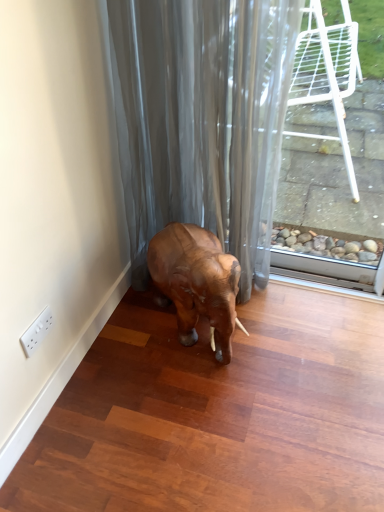
Where is `brown wooden elephant at center`? brown wooden elephant at center is located at coordinates tap(196, 282).

The height and width of the screenshot is (512, 384). What do you see at coordinates (196, 282) in the screenshot? I see `brown wooden elephant at center` at bounding box center [196, 282].

This screenshot has height=512, width=384. What do you see at coordinates (202, 120) in the screenshot?
I see `satin gray curtain at lower center` at bounding box center [202, 120].

What is the approximate width of satin gray curtain at lower center?

14.34 inches.

Identify the location of satin gray curtain at lower center. (202, 120).

I want to click on brown wooden elephant at center, so tap(196, 282).

Would you say brown wooden elephant at center is to the left or to the right of satin gray curtain at lower center in the picture?

In the image, brown wooden elephant at center appears on the right side of satin gray curtain at lower center.

Who is more distant, brown wooden elephant at center or satin gray curtain at lower center?

brown wooden elephant at center is further from the camera.

Does point (181, 241) lie behind point (180, 111)?

Yes, it is behind point (180, 111).

From the image's perspective, is brown wooden elephant at center located above or below satin gray curtain at lower center?

From the image's perspective, brown wooden elephant at center appears below satin gray curtain at lower center.

From a real-world perspective, between brown wooden elephant at center and satin gray curtain at lower center, who is vertically lower?

brown wooden elephant at center.

Considering the sizes of brown wooden elephant at center and satin gray curtain at lower center in the image, is brown wooden elephant at center wider or thinner than satin gray curtain at lower center?

Considering their sizes, brown wooden elephant at center looks broader than satin gray curtain at lower center.

Considering the relative sizes of brown wooden elephant at center and satin gray curtain at lower center in the image provided, is brown wooden elephant at center taller than satin gray curtain at lower center?

In fact, brown wooden elephant at center may be shorter than satin gray curtain at lower center.

Which of these two, brown wooden elephant at center or satin gray curtain at lower center, is smaller?

brown wooden elephant at center is smaller.

Is brown wooden elephant at center not inside satin gray curtain at lower center?

No, brown wooden elephant at center is inside or overlapping with satin gray curtain at lower center.

Are brown wooden elephant at center and satin gray curtain at lower center making contact?

No, brown wooden elephant at center is not making contact with satin gray curtain at lower center.

Is brown wooden elephant at center oriented towards satin gray curtain at lower center?

No, brown wooden elephant at center is not facing towards satin gray curtain at lower center.

How different are the orientations of brown wooden elephant at center and satin gray curtain at lower center in degrees?

The angle between the facing direction of brown wooden elephant at center and the facing direction of satin gray curtain at lower center is 36.7 degrees.

I want to click on elephant below the satin gray curtain at lower center (from the image's perspective), so click(x=196, y=282).

In the scene shown: Considering the positions of objects satin gray curtain at lower center and brown wooden elephant at center in the image provided, who is more to the left, satin gray curtain at lower center or brown wooden elephant at center?

Positioned to the left is satin gray curtain at lower center.

From the picture: Who is more distant, satin gray curtain at lower center or brown wooden elephant at center?

brown wooden elephant at center is further away from the camera.

Considering the positions of point (261, 162) and point (194, 264), is point (261, 162) closer or farther from the camera than point (194, 264)?

Clearly, point (261, 162) is more distant from the camera than point (194, 264).

From the image's perspective, is satin gray curtain at lower center over brown wooden elephant at center?

Correct, satin gray curtain at lower center appears higher than brown wooden elephant at center in the image.

From a real-world perspective, who is located lower, satin gray curtain at lower center or brown wooden elephant at center?

From a 3D spatial view, brown wooden elephant at center is below.

Can you confirm if satin gray curtain at lower center is wider than brown wooden elephant at center?

No, satin gray curtain at lower center is not wider than brown wooden elephant at center.

Is satin gray curtain at lower center shorter than brown wooden elephant at center?

No, satin gray curtain at lower center is not shorter than brown wooden elephant at center.

Which of these two, satin gray curtain at lower center or brown wooden elephant at center, is bigger?

With larger size is satin gray curtain at lower center.

Looking at this image, is satin gray curtain at lower center outside of brown wooden elephant at center?

Yes, satin gray curtain at lower center is outside of brown wooden elephant at center.

Would you say satin gray curtain at lower center is a long distance from brown wooden elephant at center?

satin gray curtain at lower center is near brown wooden elephant at center, not far away.

Could you tell me if satin gray curtain at lower center is turned towards brown wooden elephant at center?

Yes, satin gray curtain at lower center faces towards brown wooden elephant at center.

Measure the distance between satin gray curtain at lower center and brown wooden elephant at center.

satin gray curtain at lower center is 13.60 inches away from brown wooden elephant at center.

Where is `elephant behind the satin gray curtain at lower center`? The height and width of the screenshot is (512, 384). elephant behind the satin gray curtain at lower center is located at coordinates (196, 282).

You are a GUI agent. You are given a task and a screenshot of the screen. Output one action in this format:
    pyautogui.click(x=<x>, y=<y>)
    Task: Click on the elephant that appears below the satin gray curtain at lower center (from a real-world perspective)
    
    Given the screenshot: What is the action you would take?
    pyautogui.click(x=196, y=282)

The width and height of the screenshot is (384, 512). What are the coordinates of `elephant located behind the satin gray curtain at lower center` in the screenshot? It's located at (196, 282).